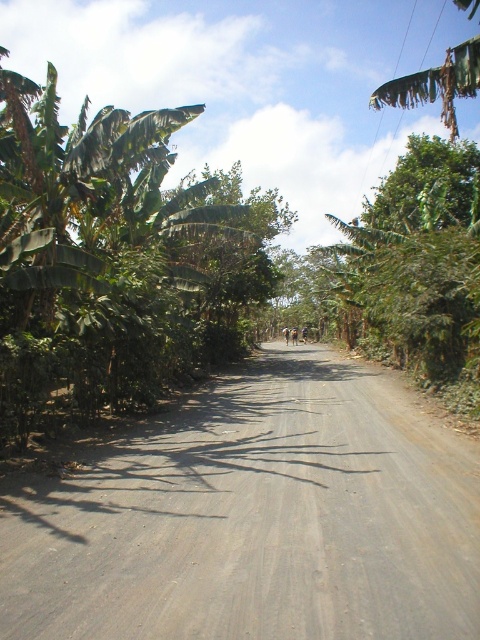
You are driving a truck that is 2 meters wide. You come across a narrow section of the road. The gray gravel road at center and the green leafy tree at center are in your path. Which object will you need to maneuver around first?

The gray gravel road at center has a lesser width compared to the green leafy tree at center, so you will need to maneuver around the gray gravel road at center first since it is narrower and poses a more immediate obstacle for your truck.

Based on the photo, you are standing at the point labeled as point (255, 518) on the image. What is the surface material under your feet?

The point (255, 518) indicates gray gravel road at center, so the surface material under your feet is gray gravel road at center.

You are standing at the center of the unpaved road in the rural scene. You see a point marked at coordinates (113, 260). Which object does this point correspond to?

The point corresponds to the green leafy banana tree at left.